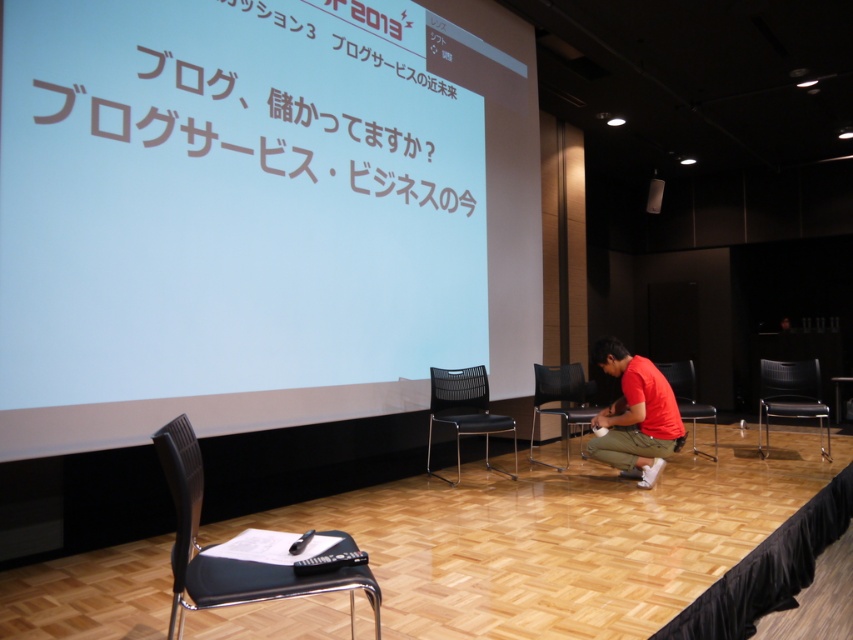
Question: Can you confirm if matte red shirt at lower right is smaller than black leather chair at center?

Choices:
 (A) yes
 (B) no

Answer: (B)

Question: Which point is closer to the camera?

Choices:
 (A) (195, 93)
 (B) (560, 406)
 (C) (689, 417)

Answer: (A)

Question: Among these objects, which one is nearest to the camera?

Choices:
 (A) black mesh chair at center
 (B) white matte projection screen at upper center

Answer: (B)

Question: Is black plastic chair at lower left positioned in front of matte red shirt at lower right?

Choices:
 (A) no
 (B) yes

Answer: (B)

Question: Which object is positioned farthest from the white text on screen at center?

Choices:
 (A) black plastic chair at lower left
 (B) black leather chair at center
 (C) black leather chair at lower right
 (D) white matte projection screen at upper center

Answer: (C)

Question: Is white matte projection screen at upper center positioned in front of black plastic chair at lower left?

Choices:
 (A) yes
 (B) no

Answer: (B)